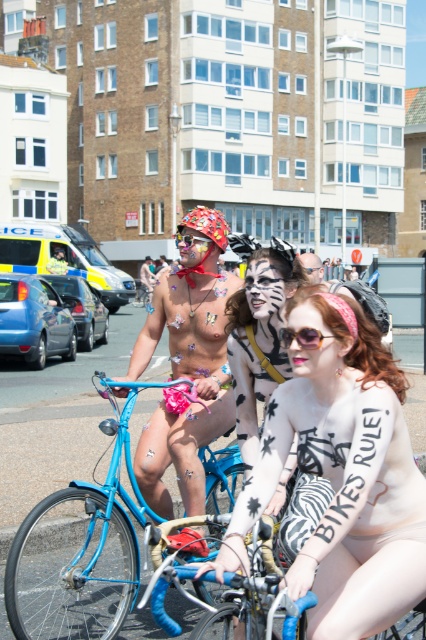
Can you confirm if white body paint at center is positioned below pink plastic goggles at center?

Yes, white body paint at center is below pink plastic goggles at center.

Between white body paint at center and pink plastic goggles at center, which one appears on the right side from the viewer's perspective?

white body paint at center is more to the right.

Does point (339, 512) come behind point (284, 326)?

That is False.

Where is `white body paint at center`? white body paint at center is located at coordinates (344, 480).

Does shiny metallic helmet at center appear on the right side of smooth skin face at center?

In fact, shiny metallic helmet at center is to the left of smooth skin face at center.

Can you confirm if shiny metallic helmet at center is smaller than smooth skin face at center?

Incorrect, shiny metallic helmet at center is not smaller in size than smooth skin face at center.

Is point (192, 216) closer to camera compared to point (304, 257)?

Yes, it is.

The height and width of the screenshot is (640, 426). In order to click on shiny metallic helmet at center in this screenshot , I will do `click(207, 225)`.

Is point (120, 275) positioned before point (149, 300)?

Yes, point (120, 275) is in front of point (149, 300).

Does yellow metallic ambulance at upper left lie behind metallic body paint at center?

No.

What do you see at coordinates (66, 257) in the screenshot? I see `yellow metallic ambulance at upper left` at bounding box center [66, 257].

At what (x,y) coordinates should I click in order to perform the action: click on yellow metallic ambulance at upper left. Please return your answer as a coordinate pair (x, y). The width and height of the screenshot is (426, 640). Looking at the image, I should click on (66, 257).